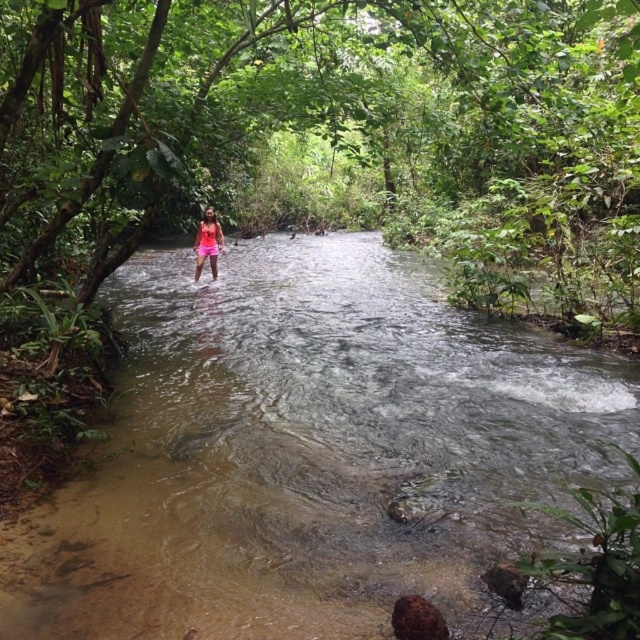
You are a photographer aiming to capture the pink fabric at center in the background while focusing on the clear water stream at center. Given the distance between them, can you use a standard camera lens with a focal length of 50mm to achieve this without moving closer?

The distance between the clear water stream at center and the pink fabric at center is 6.06 meters. With a standard 50mm lens, it is possible to capture both the foreground stream and the background pink fabric in focus, as the depth of field at this distance can maintain both elements sharp without needing to move closer.

You are a hiker who wants to cross the clear water stream at center without getting your pink fabric at center wet. Based on the scene, is there a way to do this?

The clear water stream at center is much taller than the pink fabric at center, so the water is deeper than the height of the pink fabric. Therefore, it is not possible to cross without getting the pink fabric at center wet.

You are planning to cross the clear water stream at center while wearing the pink fabric at center. Considering the size difference between them, which one takes up more space in the image?

The clear water stream at center is larger in size than the pink fabric at center, so the clear water stream at center takes up more space in the image.